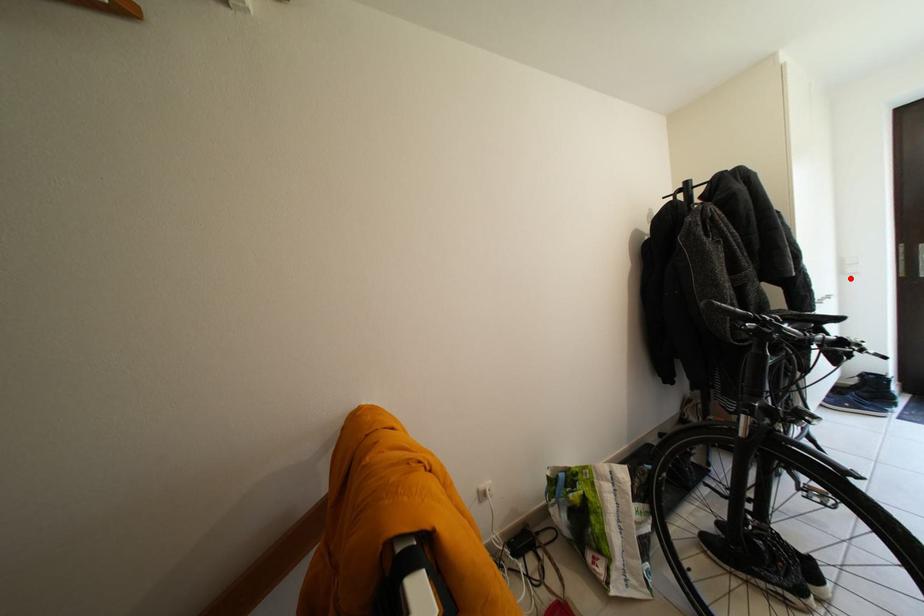
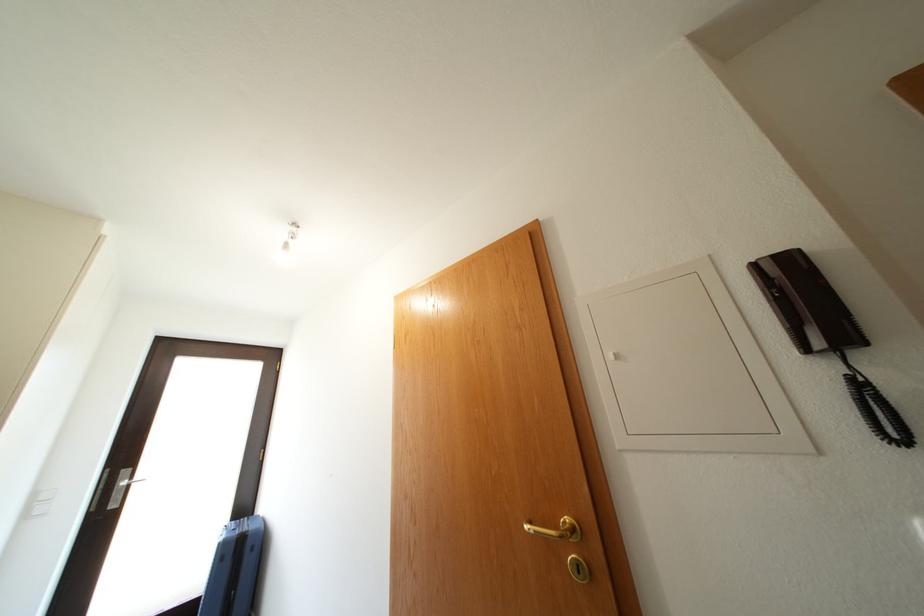
Locate, in the second image, the point that corresponds to the highlighted location in the first image.

(33, 522)